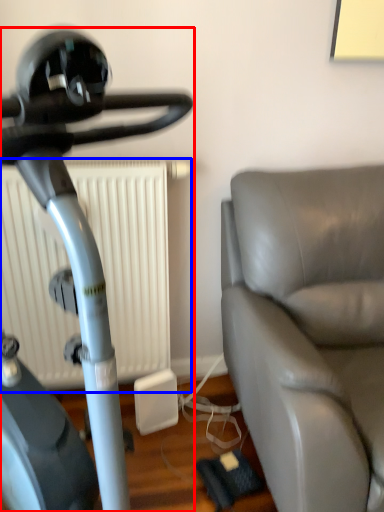
Question: Which object is further to the camera taking this photo, stationary bicycle (highlighted by a red box) or radiator (highlighted by a blue box)?

Choices:
 (A) stationary bicycle
 (B) radiator

Answer: (B)